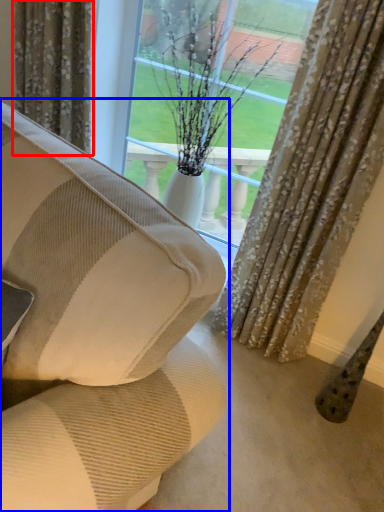
Question: Which object appears closest to the camera in this image, curtain (highlighted by a red box) or studio couch (highlighted by a blue box)?

Choices:
 (A) curtain
 (B) studio couch

Answer: (B)